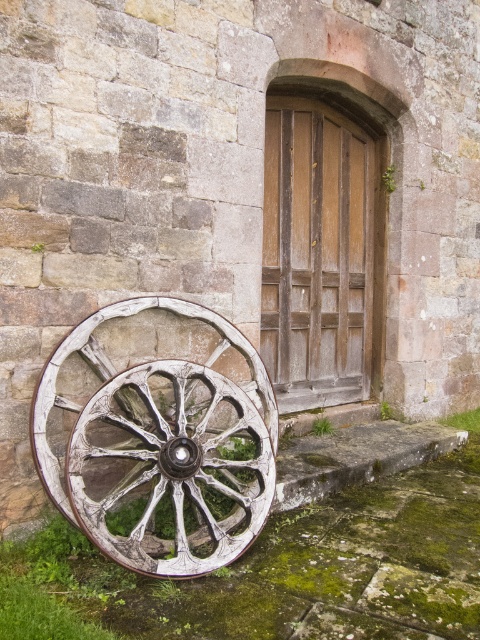
You are a painter who needs to move a ladder through the wooden door at center. The ladder is as wide as the white wooden wagon wheel at lower left. Will the ladder fit through the door?

The white wooden wagon wheel at lower left is wider than the wooden door at center. Since the ladder is as wide as the wheel, it will not fit through the door.

Looking at this image, you are a painter who wants to paint the wooden door at center but needs to first move the white wooden wagon wheel at lower left. Based on the scene, where should you move the wheel so it doesn

The white wooden wagon wheel at lower left is positioned under the wooden door at center. To move it, you should relocate the wheel to a position not obstructing the door, perhaps to the right side of the doorway or further away from the door to access it for painting.